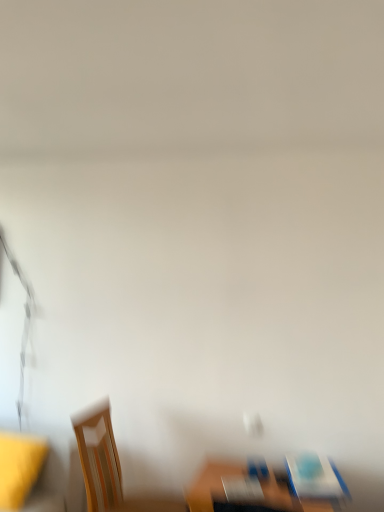
Question: Can we say wooden table at lower center lies outside yellow fabric at left?

Choices:
 (A) yes
 (B) no

Answer: (A)

Question: Does wooden table at lower center have a lesser height compared to yellow fabric at left?

Choices:
 (A) no
 (B) yes

Answer: (B)

Question: Does wooden table at lower center have a lesser width compared to yellow fabric at left?

Choices:
 (A) yes
 (B) no

Answer: (B)

Question: Does wooden table at lower center have a greater width compared to yellow fabric at left?

Choices:
 (A) yes
 (B) no

Answer: (A)

Question: Is wooden table at lower center to the right of yellow fabric at left from the viewer's perspective?

Choices:
 (A) no
 (B) yes

Answer: (B)

Question: Considering the positions of wooden table at lower center and matte wood chair at lower right, acting as the 1th chair starting from the top, in the image, is wooden table at lower center taller or shorter than matte wood chair at lower right, acting as the 1th chair starting from the top,?

Choices:
 (A) tall
 (B) short

Answer: (A)

Question: Is wooden table at lower center wider or thinner than matte wood chair at lower right, acting as the 1th chair starting from the top?

Choices:
 (A) wide
 (B) thin

Answer: (A)

Question: Considering the positions of point [279, 476] and point [327, 464], is point [279, 476] closer or farther from the camera than point [327, 464]?

Choices:
 (A) closer
 (B) farther

Answer: (A)

Question: Is wooden table at lower center bigger or smaller than matte wood chair at lower right, which is the second chair from bottom to top?

Choices:
 (A) small
 (B) big

Answer: (B)

Question: In terms of height, does wooden chair at lower left, which ranks as the 2th chair in top-to-bottom order, look taller or shorter compared to yellow fabric at left?

Choices:
 (A) tall
 (B) short

Answer: (A)

Question: In the image, is wooden chair at lower left, marked as the 2th chair in a right-to-left arrangement, positioned in front of or behind yellow fabric at left?

Choices:
 (A) front
 (B) behind

Answer: (A)

Question: From the image's perspective, is wooden chair at lower left, arranged as the first chair when viewed from the left, above or below yellow fabric at left?

Choices:
 (A) below
 (B) above

Answer: (B)

Question: Looking at the image, does wooden chair at lower left, which ranks as the 2th chair in top-to-bottom order, seem bigger or smaller compared to yellow fabric at left?

Choices:
 (A) small
 (B) big

Answer: (B)

Question: From a real-world perspective, is matte wood chair at lower right, which is the first chair from right to left, positioned above or below wooden table at lower center?

Choices:
 (A) below
 (B) above

Answer: (B)

Question: Is point (297, 465) positioned closer to the camera than point (220, 495)?

Choices:
 (A) farther
 (B) closer

Answer: (A)